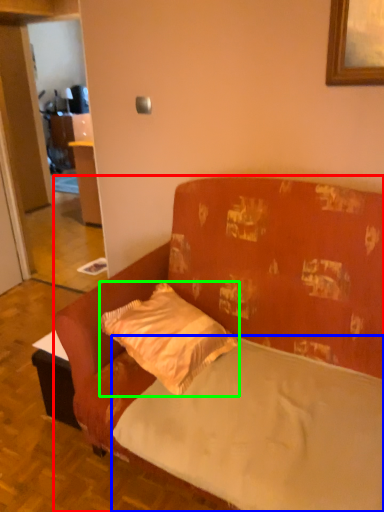
Question: Considering the real-world distances, which object is closest to studio couch (highlighted by a red box)? mattress (highlighted by a blue box) or pillow (highlighted by a green box).

Choices:
 (A) mattress
 (B) pillow

Answer: (A)